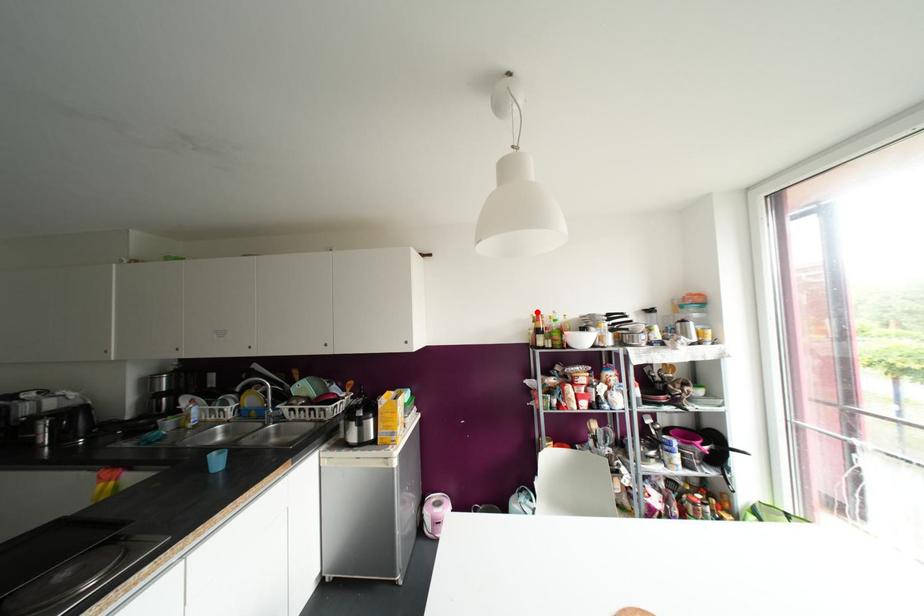
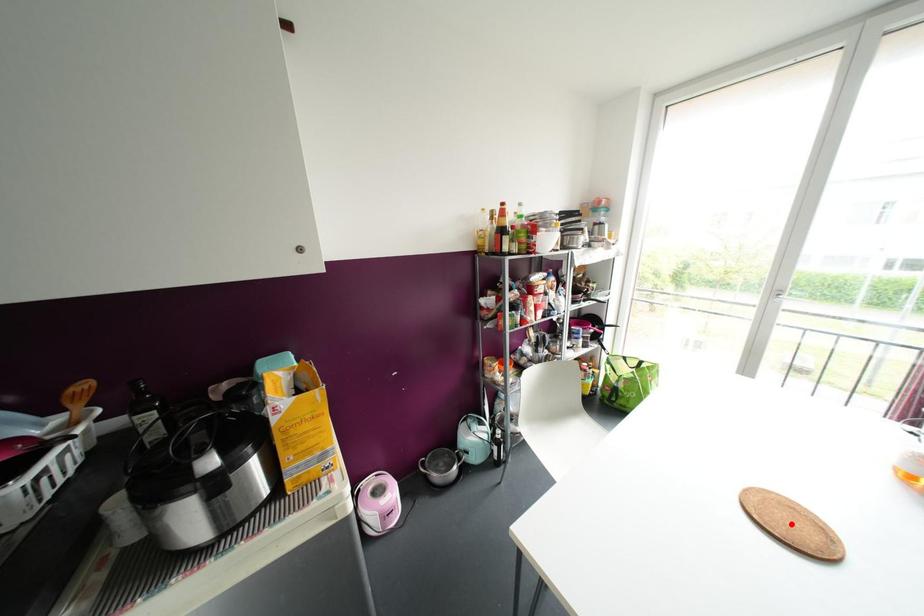
I am providing you with two images of the same scene from different viewpoints. A red point is marked on the first image and another point is marked on the second image. Do the highlighted points in image1 and image2 indicate the same real-world spot?

No